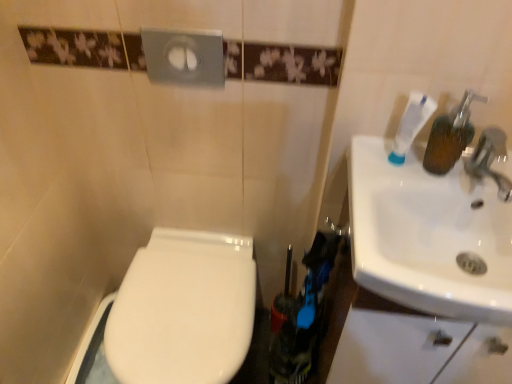
Question: In terms of width, does white glossy sink at right look wider or thinner when compared to white glossy toilet at lower left?

Choices:
 (A) wide
 (B) thin

Answer: (B)

Question: Is white glossy sink at right situated inside white glossy toilet at lower left or outside?

Choices:
 (A) outside
 (B) inside

Answer: (A)

Question: Based on their relative distances, which object is nearer to the white matte toothpaste at upper right?

Choices:
 (A) white glossy toilet at lower left
 (B) white glossy sink at right

Answer: (B)

Question: Which object is positioned closest to the white matte toothpaste at upper right?

Choices:
 (A) white glossy sink at right
 (B) white glossy toilet at lower left

Answer: (A)